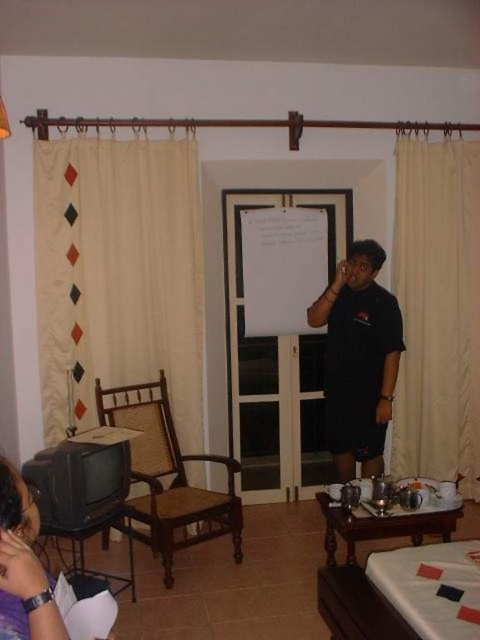
You are standing in the living room and want to hang a small picture frame between the beige fabric curtain at left and the black matte shirt at center. Based on their positions, where should you place the frame?

The beige fabric curtain at left is above the black matte shirt at center, so you should place the frame above the black matte shirt at center to position it between the two objects.

Consider the image. You are standing in the room and want to move from the brown woven armchair at left to the beige fabric curtain at left. Can you walk directly towards the curtain without moving any objects?

The brown woven armchair at left is behind the beige fabric curtain at left, so you would need to move the curtain aside or go around it to reach the chair. Since the question asks to move from the chair to the curtain, you can walk directly towards the curtain as the chair is already behind it, but physically moving from the chair to the curtain would require moving through the curtain or around it, which might not be possible without disturbing the curtain.

You are a photographer positioned at the camera. You want to capture a photo of the beige fabric curtain at left without including the person in the frame. Given that the camera is 3.60 meters away from the curtain, is it possible to frame the shot so that the person isn

The beige fabric curtain at left is 3.60 meters away from the camera. Since the person is positioned between the camera and the curtain, moving the camera back would increase the distance but might still include the person in the frame. However, adjusting the camera angle or using a telephoto lens could allow you to focus on the curtain while excluding the person, provided there is enough space or lens capability.